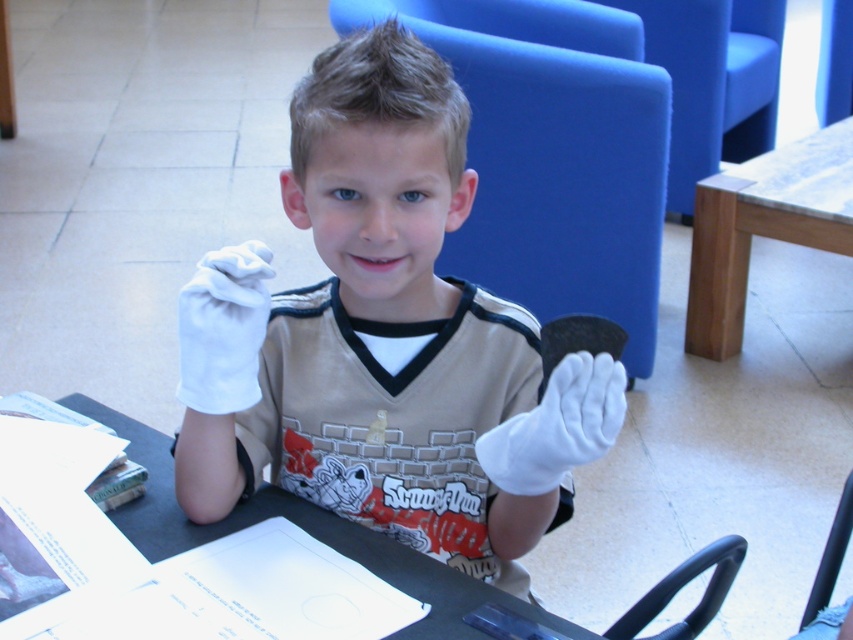
Looking at this image, you are a photographer who needs to take a closeup photo of the white cotton glove at left. You have a camera that requires you to be exactly 1.00 meters away from the subject. Can you position yourself correctly to take the photo without moving the glove?

Yes, since the white cotton glove at left and camera are 1.00 meters apart, you can position yourself exactly 1.00 meters away from the white cotton glove at left to take the photo.